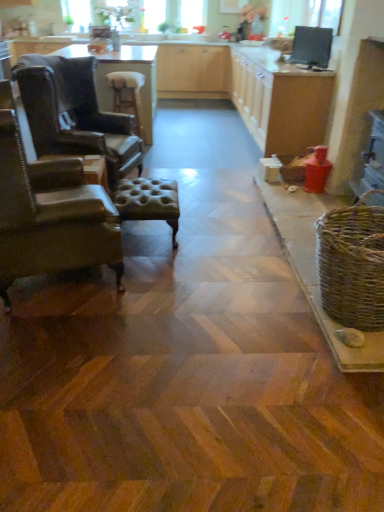
Locate an element on the screen. This screenshot has width=384, height=512. light brown wooden table at center is located at coordinates (130, 70).

At what (x,y) coordinates should I click in order to perform the action: click on light brown wooden table at center. Please return your answer as a coordinate pair (x, y). The height and width of the screenshot is (512, 384). Looking at the image, I should click on (130, 70).

Is leather armchair at left, which is the 1th chair from front to back, completely or partially outside of leather wingback chair at left, which is the 1th chair in back-to-front order?

leather armchair at left, which is the 1th chair from front to back, lies outside leather wingback chair at left, which is the 1th chair in back-to-front order,'s area.

Considering the positions of point (6, 265) and point (105, 132), is point (6, 265) closer or farther from the camera than point (105, 132)?

Point (6, 265) is positioned closer to the camera compared to point (105, 132).

Considering the sizes of objects leather armchair at left, which is the 1th chair from front to back, and leather wingback chair at left, the second chair when ordered from front to back, in the image provided, who is thinner, leather armchair at left, which is the 1th chair from front to back, or leather wingback chair at left, the second chair when ordered from front to back,?

Thinner between the two is leather armchair at left, which is the 1th chair from front to back.

From the image's perspective, who appears lower, leather armchair at left, which is the 1th chair from front to back, or leather wingback chair at left, the second chair when ordered from front to back?

From the image's view, leather armchair at left, which is the 1th chair from front to back, is below.

Is woven brown basket at right positioned beyond the bounds of leather wingback chair at left, which is the 1th chair in back-to-front order?

Yes, woven brown basket at right is located beyond the bounds of leather wingback chair at left, which is the 1th chair in back-to-front order.

Is point (324, 244) farther from camera compared to point (39, 68)?

No.

From a real-world perspective, which chair is the 2nd one above the woven brown basket at right? Please provide its 2D coordinates.

[(75, 114)]

Who is smaller, woven brown basket at right or leather wingback chair at left, the second chair when ordered from front to back?

woven brown basket at right is smaller.

Could light brown wooden table at center be considered to be inside leather wingback chair at left, the second chair when ordered from front to back?

No, leather wingback chair at left, the second chair when ordered from front to back, does not contain light brown wooden table at center.

Is leather wingback chair at left, which is the 1th chair in back-to-front order, to the left or to the right of light brown wooden table at center in the image?

Clearly, leather wingback chair at left, which is the 1th chair in back-to-front order, is on the right of light brown wooden table at center in the image.

How far apart are leather wingback chair at left, which is the 1th chair in back-to-front order, and light brown wooden table at center?

The distance of leather wingback chair at left, which is the 1th chair in back-to-front order, from light brown wooden table at center is 8.16 feet.

Considering the relative sizes of leather armchair at left, which is the 1th chair from front to back, and woven brown basket at right in the image provided, is leather armchair at left, which is the 1th chair from front to back, shorter than woven brown basket at right?

No.

Are leather armchair at left, the second chair viewed from the back, and woven brown basket at right beside each other?

No, leather armchair at left, the second chair viewed from the back, is not beside woven brown basket at right.

Is leather armchair at left, which is the 1th chair from front to back, closer to the viewer compared to woven brown basket at right?

Yes.

Which object is wider, brown leather stool at center, which ranks as the first stool in back-to-front order, or woven brown basket at right?

With larger width is woven brown basket at right.

How far apart are brown leather stool at center, the second stool ordered from the bottom, and woven brown basket at right?

brown leather stool at center, the second stool ordered from the bottom, is 3.14 meters away from woven brown basket at right.

Is brown leather stool at center, marked as the second stool in a right-to-left arrangement, at the left side of woven brown basket at right?

Correct, you'll find brown leather stool at center, marked as the second stool in a right-to-left arrangement, to the left of woven brown basket at right.

Does brown leather stool at center, the second stool ordered from the bottom, have a lesser height compared to woven brown basket at right?

No.

Consider the image. Would you say leather wingback chair at left, which is the 1th chair in back-to-front order, is part of brown leather stool at center, which is the 2th stool from front to back,'s contents?

No.

Which object is closer to the camera taking this photo, brown leather stool at center, the first stool from the top, or leather wingback chair at left, which is the 1th chair in back-to-front order?

leather wingback chair at left, which is the 1th chair in back-to-front order.

Does point (137, 123) lie behind point (104, 143)?

Yes, it is.

Measure the distance from brown leather stool at center, which is the 2th stool from front to back, to leather wingback chair at left, the second chair when ordered from front to back.

brown leather stool at center, which is the 2th stool from front to back, and leather wingback chair at left, the second chair when ordered from front to back, are 1.14 meters apart from each other.

Between woven brown basket at right and brown leather stool at center, which ranks as the first stool in back-to-front order, which one has larger width?

Wider between the two is woven brown basket at right.

Is woven brown basket at right in front of or behind brown leather stool at center, the second stool ordered from the bottom, in the image?

woven brown basket at right is in front of brown leather stool at center, the second stool ordered from the bottom.

From a real-world perspective, is woven brown basket at right under brown leather stool at center, which is the 2th stool from front to back?

Yes, from a real-world perspective, woven brown basket at right is below brown leather stool at center, which is the 2th stool from front to back.

Consider the image. In terms of size, does woven brown basket at right appear bigger or smaller than brown leather stool at center, which ranks as the first stool in back-to-front order?

Considering their sizes, woven brown basket at right takes up more space than brown leather stool at center, which ranks as the first stool in back-to-front order.

Where is `chair that is under the leather wingback chair at left, which is the 1th chair in back-to-front order (from a real-world perspective)`? The width and height of the screenshot is (384, 512). chair that is under the leather wingback chair at left, which is the 1th chair in back-to-front order (from a real-world perspective) is located at coordinates (50, 218).

The width and height of the screenshot is (384, 512). Find the location of `chair that is the 2nd object above the woven brown basket at right (from a real-world perspective)`. chair that is the 2nd object above the woven brown basket at right (from a real-world perspective) is located at coordinates (75, 114).

Based on their spatial positions, is woven brown basket at right or light brown wooden table at center further from leather wingback chair at left, which is the 1th chair in back-to-front order?

Among the two, light brown wooden table at center is located further to leather wingback chair at left, which is the 1th chair in back-to-front order.

Which object lies further to the anchor point leather tufted stool at center, the 1th stool positioned from the right, brown leather stool at center, the second stool ordered from the bottom, or leather armchair at left, the second chair viewed from the back?

brown leather stool at center, the second stool ordered from the bottom, lies further to leather tufted stool at center, the 1th stool positioned from the right, than the other object.

Which object lies nearer to the anchor point woven brown basket at right, brown leather stool at center, the first stool from the top, or leather wingback chair at left, the second chair when ordered from front to back?

leather wingback chair at left, the second chair when ordered from front to back, is positioned closer to the anchor woven brown basket at right.

Which object lies nearer to the anchor point brown leather stool at center, marked as the second stool in a right-to-left arrangement, leather tufted stool at center, the second stool viewed from the back, or woven brown basket at right?

leather tufted stool at center, the second stool viewed from the back, is closer to brown leather stool at center, marked as the second stool in a right-to-left arrangement.

Estimate the real-world distances between objects in this image. Which object is closer to matte wood counter top at center, woven brown basket at right or leather wingback chair at left, which is the 1th chair in back-to-front order?

The object closer to matte wood counter top at center is leather wingback chair at left, which is the 1th chair in back-to-front order.

Estimate the real-world distances between objects in this image. Which object is closer to leather armchair at left, which is the 1th chair from front to back, matte wood counter top at center or light brown wooden table at center?

matte wood counter top at center.

Looking at the image, which one is located closer to brown leather stool at center, which is the 1th stool from left to right, leather tufted stool at center, the second stool when ordered from left to right, or leather armchair at left, which is the 1th chair from front to back?

The object closer to brown leather stool at center, which is the 1th stool from left to right, is leather tufted stool at center, the second stool when ordered from left to right.

Based on the photo, considering their positions, is leather armchair at left, which is the 1th chair from front to back, positioned further to wooden cabinet at center than woven brown basket at right?

Based on the image, leather armchair at left, which is the 1th chair from front to back, appears to be further to wooden cabinet at center.

Where is `basket between leather armchair at left, the second chair viewed from the back, and brown leather stool at center, which is the 2th stool from front to back, from front to back`? basket between leather armchair at left, the second chair viewed from the back, and brown leather stool at center, which is the 2th stool from front to back, from front to back is located at coordinates (352, 264).

At what (x,y) coordinates should I click in order to perform the action: click on cabinetry between matte wood counter top at center and woven brown basket at right from top to bottom. Please return your answer as a coordinate pair (x, y). The width and height of the screenshot is (384, 512). Looking at the image, I should click on (280, 100).

Image resolution: width=384 pixels, height=512 pixels. I want to click on chair positioned between leather armchair at left, which is the 1th chair from front to back, and wooden cabinet at center from near to far, so click(x=75, y=114).

The height and width of the screenshot is (512, 384). Find the location of `stool between wooden cabinet at center and leather tufted stool at center, acting as the first stool starting from the front, in the up-down direction`. stool between wooden cabinet at center and leather tufted stool at center, acting as the first stool starting from the front, in the up-down direction is located at coordinates (130, 95).